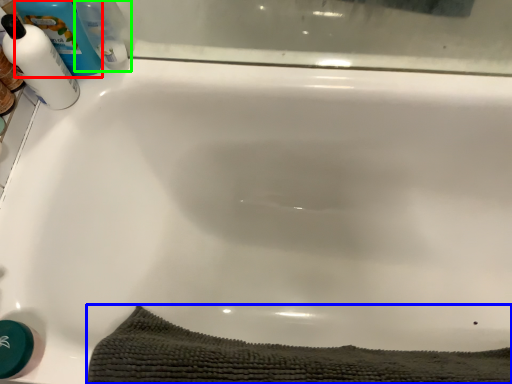
Question: Based on their relative distances, which object is nearer to cleaning product (highlighted by a red box)? Choose from bath towel (highlighted by a blue box) and cleaning product (highlighted by a green box).

Choices:
 (A) bath towel
 (B) cleaning product

Answer: (B)